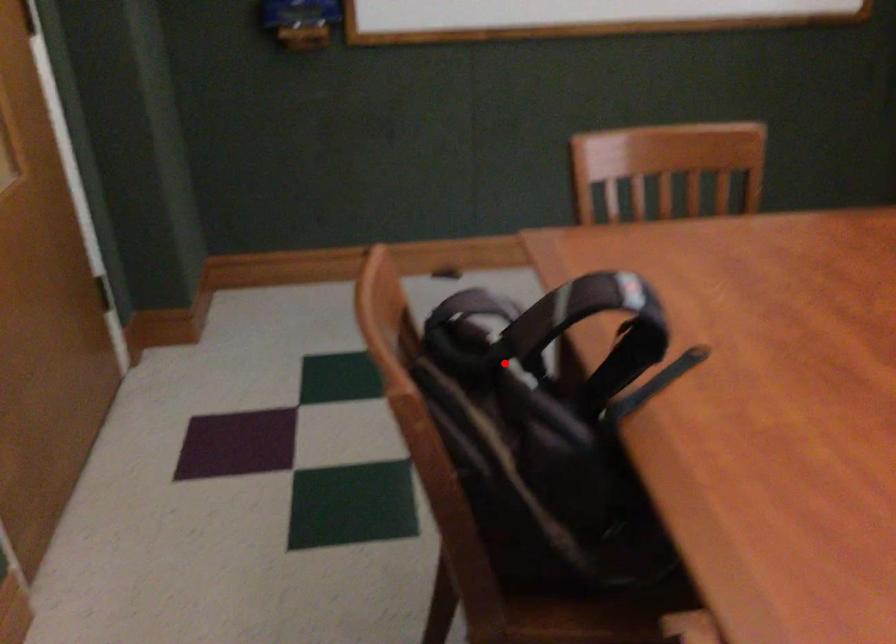
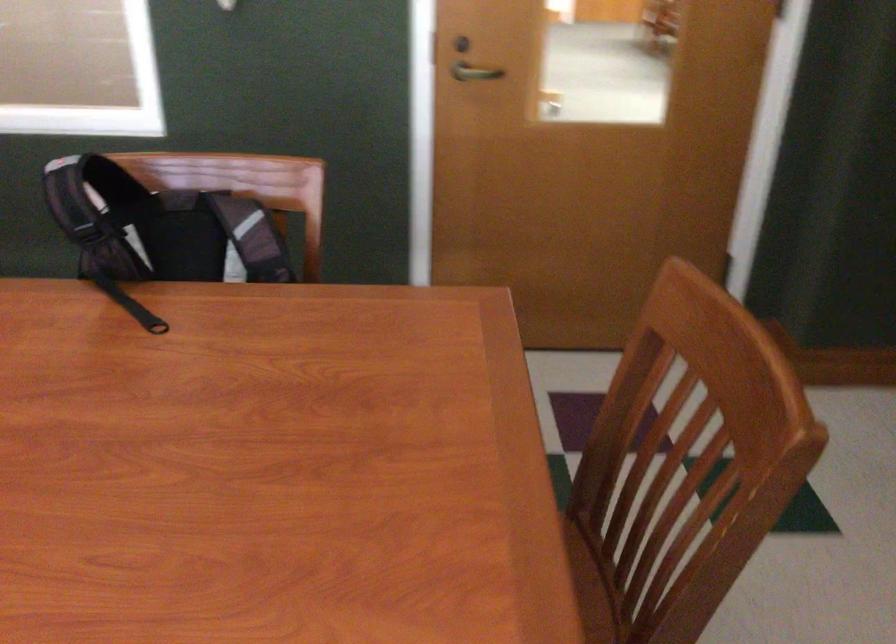
Find the pixel in the second image that matches the highlighted location in the first image.

(159, 228)